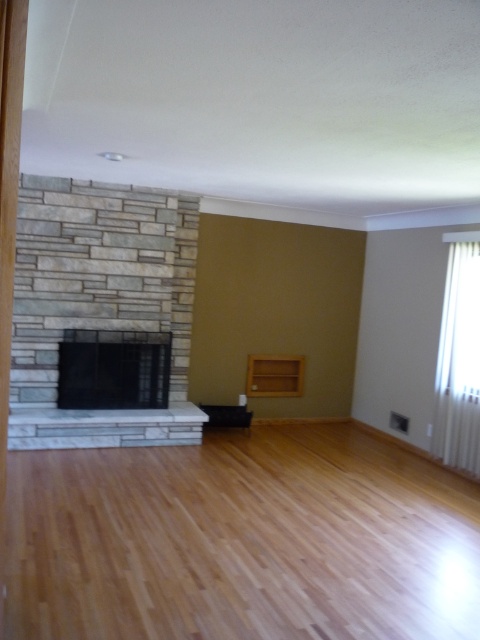
Is white marble fireplace at center thinner than light brown wood shelf at center?

No, white marble fireplace at center is not thinner than light brown wood shelf at center.

Does white marble fireplace at center have a larger size compared to light brown wood shelf at center?

Yes, white marble fireplace at center is bigger than light brown wood shelf at center.

What do you see at coordinates (105, 428) in the screenshot? I see `white marble fireplace at center` at bounding box center [105, 428].

Where is `white marble fireplace at center`? white marble fireplace at center is located at coordinates (x=105, y=428).

Which of these two, black glass fireplace at center or white marble fireplace at center, stands taller?

Standing taller between the two is black glass fireplace at center.

Which is below, black glass fireplace at center or white marble fireplace at center?

white marble fireplace at center is below.

Between point (132, 378) and point (39, 445), which one is positioned behind?

The point (132, 378) is more distant.

Locate an element on the screen. black glass fireplace at center is located at coordinates (113, 369).

Is white marble fireplace at center behind white plastic radiator at right?

No, white marble fireplace at center is in front of white plastic radiator at right.

The width and height of the screenshot is (480, 640). Describe the element at coordinates (105, 428) in the screenshot. I see `white marble fireplace at center` at that location.

Locate an element on the screen. white marble fireplace at center is located at coordinates (105, 428).